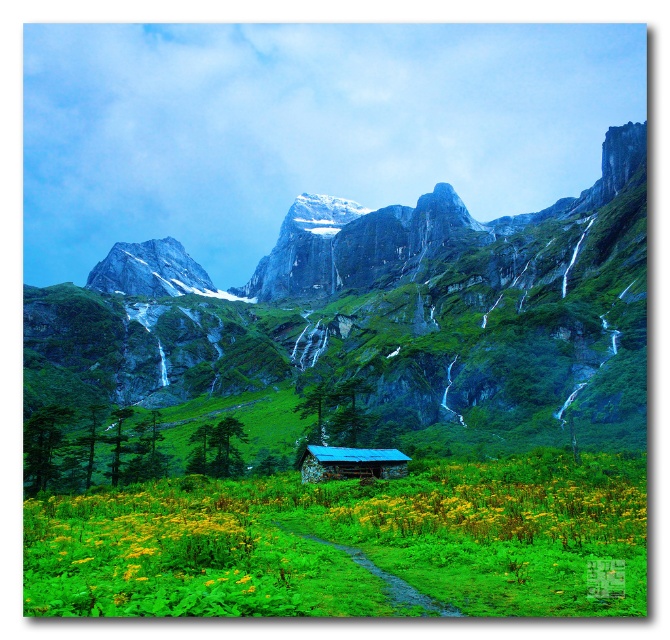
You are a hiker standing on the path in the meadow. You see the green grassy field at lower center and the yellow matte flower at lower center. Which one is closer to you?

The yellow matte flower at lower center is closer to you because it is positioned under the green grassy field at lower center.